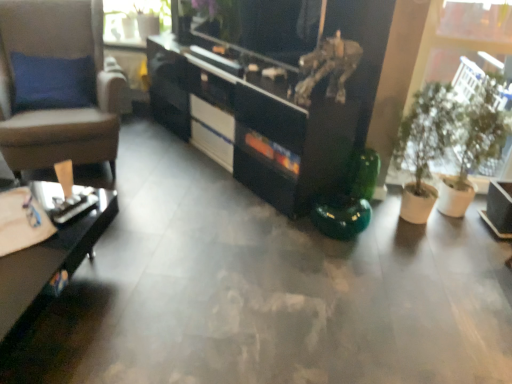
Question: Would you say black glossy desk at lower left is part of white glossy drawer at center's contents?

Choices:
 (A) yes
 (B) no

Answer: (B)

Question: From a real-world perspective, is white glossy drawer at center under black glossy desk at lower left?

Choices:
 (A) yes
 (B) no

Answer: (A)

Question: Can you confirm if white glossy drawer at center is taller than black glossy desk at lower left?

Choices:
 (A) yes
 (B) no

Answer: (B)

Question: Is white glossy drawer at center smaller than black glossy desk at lower left?

Choices:
 (A) no
 (B) yes

Answer: (B)

Question: Is white glossy drawer at center wider than black glossy desk at lower left?

Choices:
 (A) no
 (B) yes

Answer: (A)

Question: From the image's perspective, relative to white glossy drawer at center, is clear glass vase at upper left above or below?

Choices:
 (A) above
 (B) below

Answer: (A)

Question: Considering their positions, is clear glass vase at upper left located in front of or behind white glossy drawer at center?

Choices:
 (A) front
 (B) behind

Answer: (B)

Question: Considering the positions of clear glass vase at upper left and white glossy drawer at center in the image, is clear glass vase at upper left taller or shorter than white glossy drawer at center?

Choices:
 (A) short
 (B) tall

Answer: (B)

Question: Visually, is clear glass vase at upper left positioned to the left or to the right of white glossy drawer at center?

Choices:
 (A) right
 (B) left

Answer: (B)

Question: Does point click(x=331, y=96) appear closer or farther from the camera than point click(x=44, y=294)?

Choices:
 (A) closer
 (B) farther

Answer: (B)

Question: From the image's perspective, is black glossy cabinet at center located above or below black glossy desk at lower left?

Choices:
 (A) below
 (B) above

Answer: (B)

Question: Considering their positions, is black glossy cabinet at center located in front of or behind black glossy desk at lower left?

Choices:
 (A) front
 (B) behind

Answer: (B)

Question: In the image, is black glossy cabinet at center on the left side or the right side of black glossy desk at lower left?

Choices:
 (A) left
 (B) right

Answer: (B)

Question: In the image, is clear glass vase at upper left positioned in front of or behind black glossy desk at lower left?

Choices:
 (A) behind
 (B) front

Answer: (A)

Question: From a real-world perspective, relative to black glossy desk at lower left, is clear glass vase at upper left vertically above or below?

Choices:
 (A) above
 (B) below

Answer: (A)